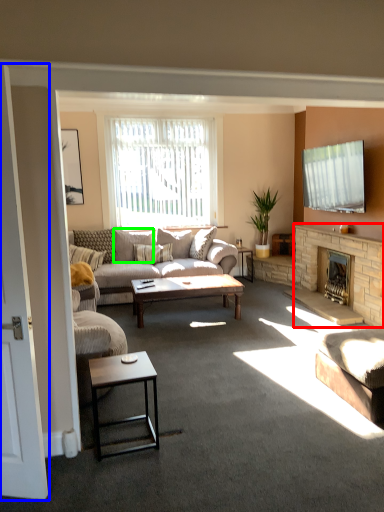
Question: Which object is positioned closest to fireplace (highlighted by a red box)? Select from screen door (highlighted by a blue box) and pillow (highlighted by a green box).

Choices:
 (A) screen door
 (B) pillow

Answer: (B)